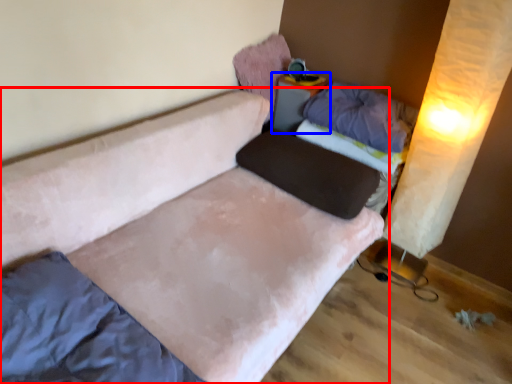
Question: Which of the following is the closest to the observer, studio couch (highlighted by a red box) or table (highlighted by a blue box)?

Choices:
 (A) studio couch
 (B) table

Answer: (A)